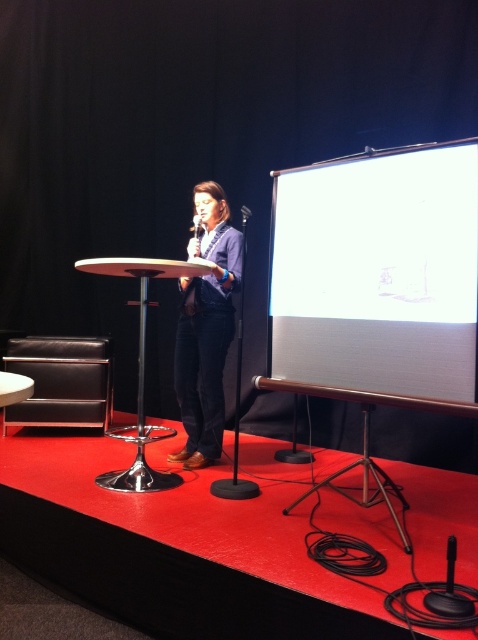
Does metallic silver podium at center appear on the left side of black plastic microphone at center?

Indeed, metallic silver podium at center is positioned on the left side of black plastic microphone at center.

Consider the image. Which is below, metallic silver podium at center or black plastic microphone at center?

metallic silver podium at center is lower down.

Does point (162, 429) lie in front of point (197, 228)?

No, (162, 429) is behind (197, 228).

Where is `metallic silver podium at center`? This screenshot has width=478, height=640. metallic silver podium at center is located at coordinates (141, 372).

Who is positioned more to the right, denim jacket at center or black matte microphone at center?

From the viewer's perspective, black matte microphone at center appears more on the right side.

Based on the photo, does denim jacket at center have a lesser height compared to black matte microphone at center?

In fact, denim jacket at center may be taller than black matte microphone at center.

This screenshot has height=640, width=478. What do you see at coordinates (206, 328) in the screenshot?
I see `denim jacket at center` at bounding box center [206, 328].

What are the coordinates of `denim jacket at center` in the screenshot? It's located at (206, 328).

What do you see at coordinates (378, 272) in the screenshot? The height and width of the screenshot is (640, 478). I see `white matte projection screen at right` at bounding box center [378, 272].

I want to click on white matte projection screen at right, so click(378, 272).

Identify the location of white matte projection screen at right. (378, 272).